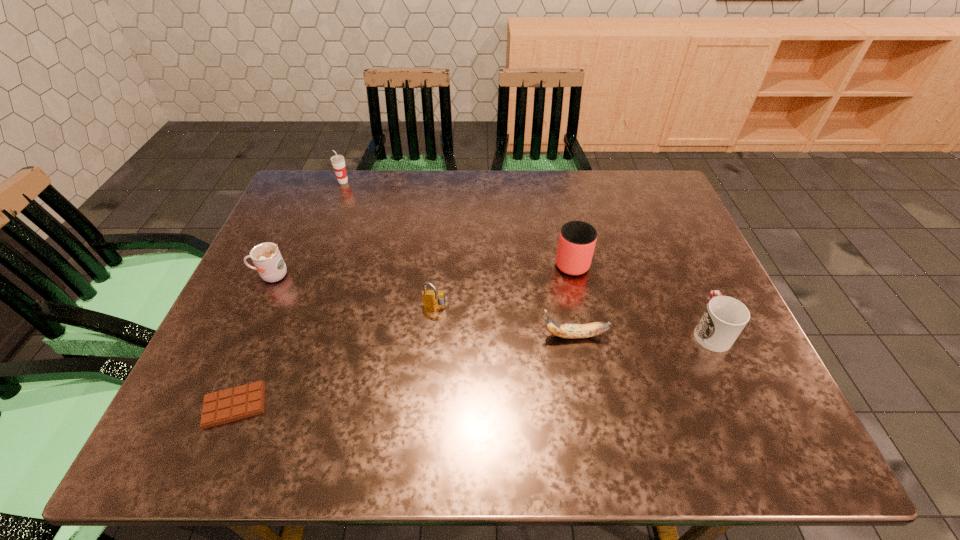
Locate an element on the screen. Image resolution: width=960 pixels, height=540 pixels. the second cup from left to right is located at coordinates (338, 162).

Where is `the farthest cup`? The height and width of the screenshot is (540, 960). the farthest cup is located at coordinates (338, 162).

Identify the location of the second cup from right to left. (577, 239).

This screenshot has width=960, height=540. In order to click on the leftmost cup in this screenshot , I will do `click(266, 257)`.

Locate an element on the screen. The image size is (960, 540). the rightmost object is located at coordinates pyautogui.click(x=724, y=318).

Find the location of a particular element. Image resolution: width=960 pixels, height=540 pixels. the nearest cup is located at coordinates (724, 318).

Find the location of a particular element. The height and width of the screenshot is (540, 960). padlock is located at coordinates (433, 298).

Where is `banana`? The image size is (960, 540). banana is located at coordinates click(x=570, y=331).

This screenshot has width=960, height=540. In order to click on the nearest object in this screenshot , I will do `click(244, 401)`.

The width and height of the screenshot is (960, 540). Find the location of `the shortest object`. the shortest object is located at coordinates (244, 401).